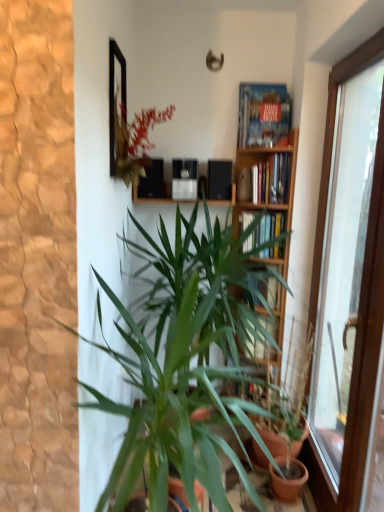
Where is `matte black speakers at upper center`? The width and height of the screenshot is (384, 512). matte black speakers at upper center is located at coordinates (156, 199).

How much space does green leafy plant at center, placed as the second houseplant when sorted from right to left, occupy vertically?

green leafy plant at center, placed as the second houseplant when sorted from right to left, is 4.36 feet in height.

The height and width of the screenshot is (512, 384). What do you see at coordinates (271, 180) in the screenshot? I see `wooden bookshelf at upper center, the second book positioned from the bottom` at bounding box center [271, 180].

What is the approximate height of hardcover books at center, which is the first book from bottom to top?

26.81 centimeters.

Find the location of `hardcover books at center, which is the first book from bottom to top`. hardcover books at center, which is the first book from bottom to top is located at coordinates (265, 231).

At what (x,y) coordinates should I click in order to perform the action: click on matte black speakers at upper center. Please return your answer as a coordinate pair (x, y). The image size is (384, 512). Looking at the image, I should click on (156, 199).

Which is behind, point (241, 222) or point (235, 202)?

The point (235, 202) is behind.

Considering the relative sizes of hardcover books at center, which is the first book from bottom to top, and matte black speakers at upper center in the image provided, is hardcover books at center, which is the first book from bottom to top, thinner than matte black speakers at upper center?

No.

Is hardcover books at center, acting as the 3th book starting from the top, in front of or behind matte black speakers at upper center in the image?

Clearly, hardcover books at center, acting as the 3th book starting from the top, is in front of matte black speakers at upper center.

Is matte black speakers at upper center surrounded by hardcover books at center, which is the first book from bottom to top?

Actually, matte black speakers at upper center is outside hardcover books at center, which is the first book from bottom to top.

Is green leafy plant at center, the 2th houseplant positioned from the back, at the back of matte black speakers at upper center?

matte black speakers at upper center is not turned away from green leafy plant at center, the 2th houseplant positioned from the back.

How much distance is there between matte black speakers at upper center and green leafy plant at center, the 2th houseplant positioned from the back?

They are 80.74 centimeters apart.

Considering the sizes of objects matte black speakers at upper center and green leafy plant at center, the first houseplant viewed from the left, in the image provided, who is smaller, matte black speakers at upper center or green leafy plant at center, the first houseplant viewed from the left,?

Smaller between the two is matte black speakers at upper center.

From the image's perspective, does matte black speakers at upper center appear lower than green leafy plant at center, the 2th houseplant positioned from the back?

No, from the image's perspective, matte black speakers at upper center is not below green leafy plant at center, the 2th houseplant positioned from the back.

Does point (135, 194) come behind point (337, 498)?

Yes, point (135, 194) is behind point (337, 498).

Is matte black speakers at upper center aimed at transparent glass door at right?

No, matte black speakers at upper center is not turned towards transparent glass door at right.

Who is shorter, matte black speakers at upper center or transparent glass door at right?

matte black speakers at upper center is shorter.

From a real-world perspective, relative to transparent glass door at right, is matte black speakers at upper center vertically above or below?

From a real-world perspective, matte black speakers at upper center is physically above transparent glass door at right.

Choose the correct answer: Is wooden bookshelf at center inside wooden bookshelf at upper center, the second book positioned from the bottom, or outside it?

The correct answer is: outside.

From a real-world perspective, is wooden bookshelf at center physically located above or below wooden bookshelf at upper center, marked as the 2th book in a top-to-bottom arrangement?

From a real-world perspective, wooden bookshelf at center is physically below wooden bookshelf at upper center, marked as the 2th book in a top-to-bottom arrangement.

Where is `bookcase below the wooden bookshelf at upper center, the second book positioned from the bottom (from the image's perspective)`? bookcase below the wooden bookshelf at upper center, the second book positioned from the bottom (from the image's perspective) is located at coordinates (266, 170).

Considering the sizes of wooden bookshelf at center and wooden bookshelf at upper center, marked as the 2th book in a top-to-bottom arrangement, in the image, is wooden bookshelf at center bigger or smaller than wooden bookshelf at upper center, marked as the 2th book in a top-to-bottom arrangement,?

Clearly, wooden bookshelf at center is larger in size than wooden bookshelf at upper center, marked as the 2th book in a top-to-bottom arrangement.

Can you tell me how much transparent glass door at right and wooden bookshelf at center differ in facing direction?

There is a 89.9-degree angle between the facing directions of transparent glass door at right and wooden bookshelf at center.

Is transparent glass door at right placed right next to wooden bookshelf at center?

No, transparent glass door at right is not making contact with wooden bookshelf at center.

Is point (356, 445) behind point (269, 287)?

No, (356, 445) is in front of (269, 287).

Would you say transparent glass door at right is outside wooden bookshelf at center?

transparent glass door at right lies outside wooden bookshelf at center's area.

Is wooden bookshelf at center not close to green leafy plant at lower right, positioned as the first houseplant in right-to-left order?

No.

Is wooden bookshelf at center facing towards green leafy plant at lower right, the second houseplant when ordered from front to back?

Yes, wooden bookshelf at center is aimed at green leafy plant at lower right, the second houseplant when ordered from front to back.

Is point (274, 309) positioned after point (301, 443)?

Yes.

Would you say wooden bookshelf at center is to the left or to the right of green leafy plant at lower right, positioned as the first houseplant in right-to-left order, in the picture?

In the image, wooden bookshelf at center appears on the left side of green leafy plant at lower right, positioned as the first houseplant in right-to-left order.

Which is correct: matte black speakers at upper center is inside wooden bookshelf at center, or outside of it?

matte black speakers at upper center lies outside wooden bookshelf at center.

Can you confirm if matte black speakers at upper center is smaller than wooden bookshelf at center?

Indeed, matte black speakers at upper center has a smaller size compared to wooden bookshelf at center.

Is matte black speakers at upper center taller or shorter than wooden bookshelf at center?

matte black speakers at upper center is shorter than wooden bookshelf at center.

Considering the sizes of objects matte black speakers at upper center and wooden bookshelf at center in the image provided, who is wider, matte black speakers at upper center or wooden bookshelf at center?

wooden bookshelf at center is wider.

The height and width of the screenshot is (512, 384). I want to click on window sill above the hardcover books at center, acting as the 3th book starting from the top (from the image's perspective), so click(x=156, y=199).

Which houseplant is the 1st one when counting from the right side of the matte black speakers at upper center? Please provide its 2D coordinates.

[(182, 359)]

From the image, which object appears to be farther from green leafy plant at lower right, the 1th houseplant viewed from the back, transparent glass door at right or wooden bookshelf at center?

The object further to green leafy plant at lower right, the 1th houseplant viewed from the back, is wooden bookshelf at center.

From the image, which object appears to be nearer to blue hardcover book at upper right, the 1th book viewed from the top, green leafy plant at center, the first houseplant viewed from the left, or hardcover books at center, acting as the 3th book starting from the top?

Among the two, hardcover books at center, acting as the 3th book starting from the top, is located nearer to blue hardcover book at upper right, the 1th book viewed from the top.

When comparing their distances from blue hardcover book at upper right, the 3th book ordered from the bottom, does green leafy plant at lower right, positioned as the first houseplant in right-to-left order, or wooden bookshelf at upper center, marked as the 2th book in a top-to-bottom arrangement, seem closer?

Among the two, wooden bookshelf at upper center, marked as the 2th book in a top-to-bottom arrangement, is located nearer to blue hardcover book at upper right, the 3th book ordered from the bottom.

Estimate the real-world distances between objects in this image. Which object is closer to blue hardcover book at upper right, the 3th book ordered from the bottom, green leafy plant at center, placed as the second houseplant when sorted from right to left, or transparent glass door at right?

transparent glass door at right.

Looking at the image, which one is located closer to wooden bookshelf at upper center, the second book positioned from the bottom, blue hardcover book at upper right, the 3th book ordered from the bottom, or green leafy plant at center, placed as the second houseplant when sorted from right to left?

blue hardcover book at upper right, the 3th book ordered from the bottom.

Considering their positions, is hardcover books at center, which is the first book from bottom to top, positioned closer to wooden bookshelf at center than blue hardcover book at upper right, the 1th book viewed from the top?

The object closer to wooden bookshelf at center is blue hardcover book at upper right, the 1th book viewed from the top.

Looking at the image, which one is located closer to hardcover books at center, which is the first book from bottom to top, blue hardcover book at upper right, the 1th book viewed from the top, or green leafy plant at lower right, marked as the 2th houseplant in a left-to-right arrangement?

blue hardcover book at upper right, the 1th book viewed from the top, is closer to hardcover books at center, which is the first book from bottom to top.

Looking at the image, which one is located further to hardcover books at center, acting as the 3th book starting from the top, matte black speakers at upper center or wooden bookshelf at center?

matte black speakers at upper center.

Identify the location of window located between green leafy plant at center, placed as the first houseplant when sorted from front to back, and green leafy plant at lower right, marked as the 2th houseplant in a left-to-right arrangement, in the depth direction. Image resolution: width=384 pixels, height=512 pixels. (349, 284).

At what (x,y) coordinates should I click in order to perform the action: click on window sill between wooden bookshelf at upper center, marked as the 2th book in a top-to-bottom arrangement, and green leafy plant at lower right, the 1th houseplant viewed from the back, vertically. Please return your answer as a coordinate pair (x, y). Looking at the image, I should click on (156, 199).

The image size is (384, 512). Find the location of `window between blue hardcover book at upper right, the 1th book viewed from the top, and green leafy plant at lower right, the second houseplant when ordered from front to back, vertically`. window between blue hardcover book at upper right, the 1th book viewed from the top, and green leafy plant at lower right, the second houseplant when ordered from front to back, vertically is located at coordinates (349, 284).

This screenshot has width=384, height=512. I want to click on book located between transparent glass door at right and wooden bookshelf at upper center, marked as the 2th book in a top-to-bottom arrangement, in the depth direction, so click(x=263, y=114).